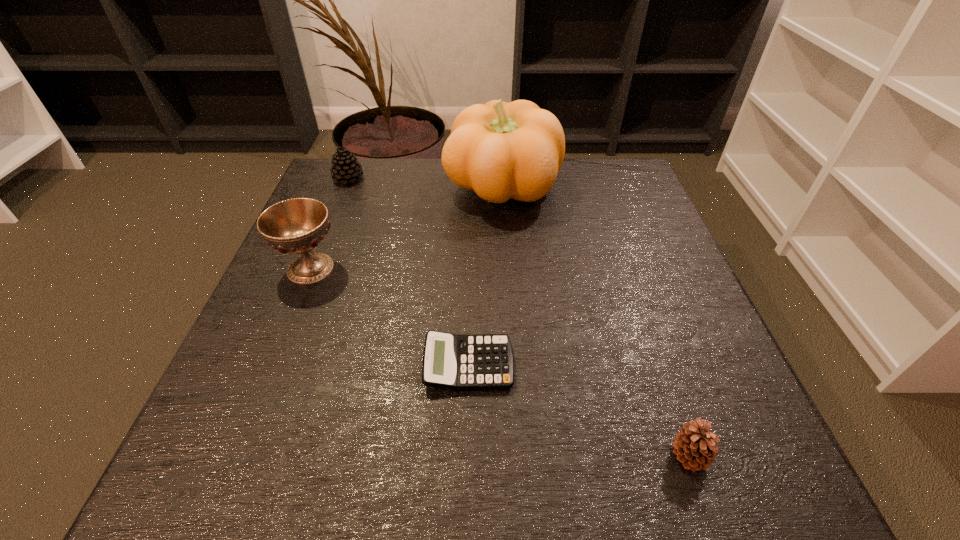
Where is `pumpkin`? pumpkin is located at coordinates (500, 150).

Find the location of a particular element. This screenshot has width=960, height=540. the third farthest object is located at coordinates (296, 226).

At what (x,y) coordinates should I click in order to perform the action: click on chalice. Please return your answer as a coordinate pair (x, y). This screenshot has width=960, height=540. Looking at the image, I should click on (296, 226).

The image size is (960, 540). I want to click on the farther pinecone, so click(345, 168).

This screenshot has height=540, width=960. In order to click on the right pinecone in this screenshot , I will do `click(694, 445)`.

Image resolution: width=960 pixels, height=540 pixels. What are the coordinates of `the nearest object` in the screenshot? It's located at (694, 445).

Locate an element on the screen. the shortest object is located at coordinates (483, 361).

The image size is (960, 540). I want to click on the fourth farthest object, so click(x=483, y=361).

Identify the location of vacant space located 0.100m on the left of the pumpkin. (404, 188).

This screenshot has width=960, height=540. Identify the location of vacant space located 0.210m on the back of the second tallest object. (341, 193).